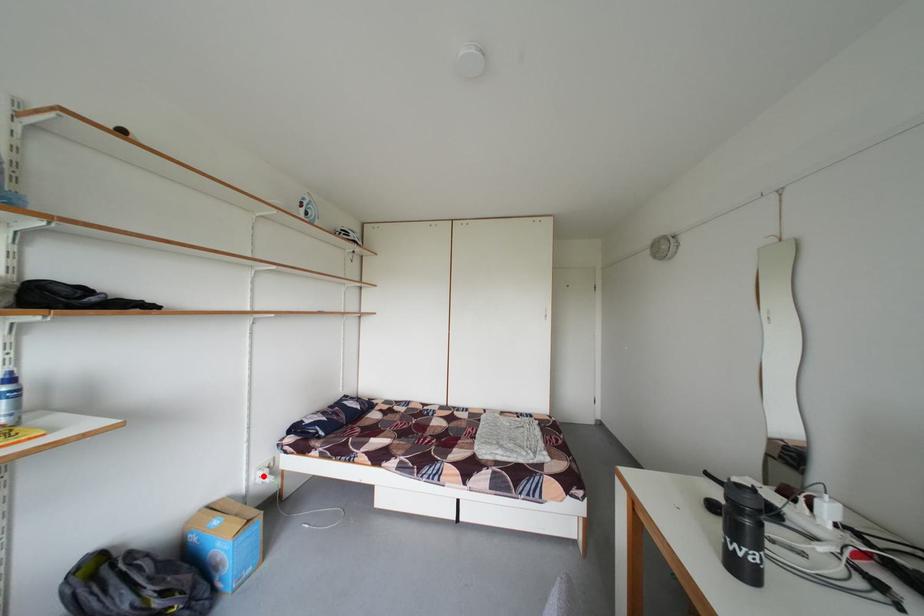
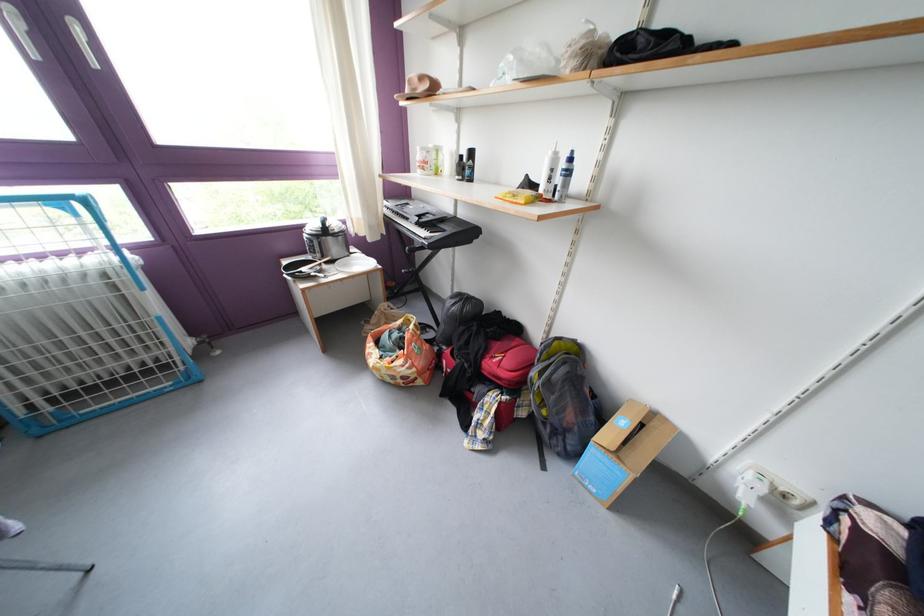
Question: I am providing you with two images of the same scene from different viewpoints. In image1, a red point is highlighted. Considering the same 3D point in image2, which of the following is correct?

Choices:
 (A) It is closer
 (B) It is farther

Answer: (A)